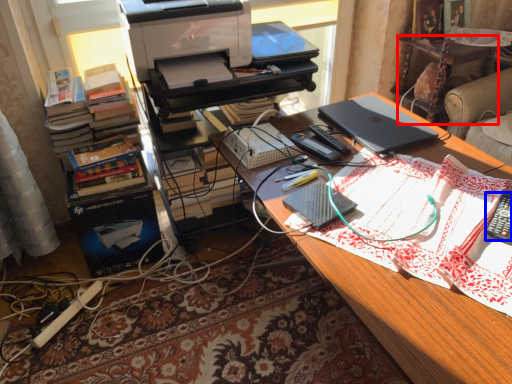
Question: Which of the following is the closest to the observer, computer desk (highlighted by a red box) or remote control (highlighted by a blue box)?

Choices:
 (A) computer desk
 (B) remote control

Answer: (B)